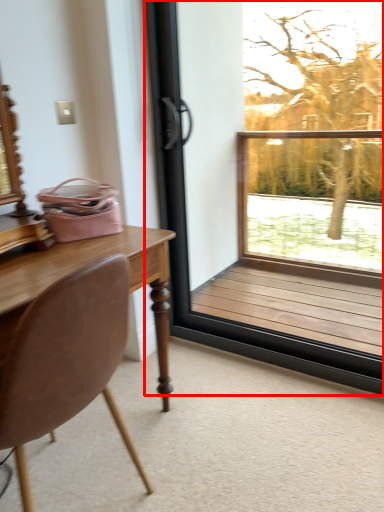
Question: In this image, where is window (annotated by the red box) located relative to chair?

Choices:
 (A) left
 (B) right

Answer: (B)